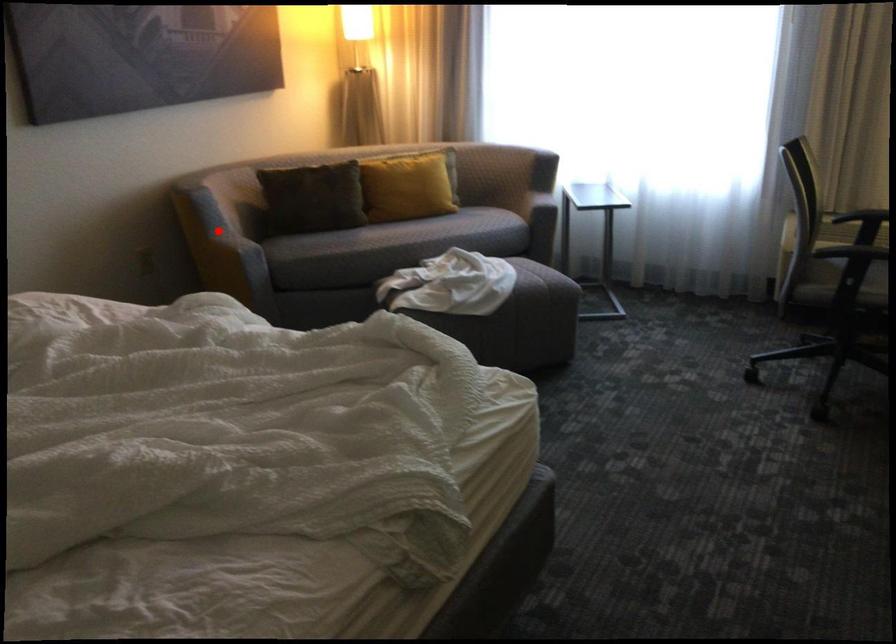
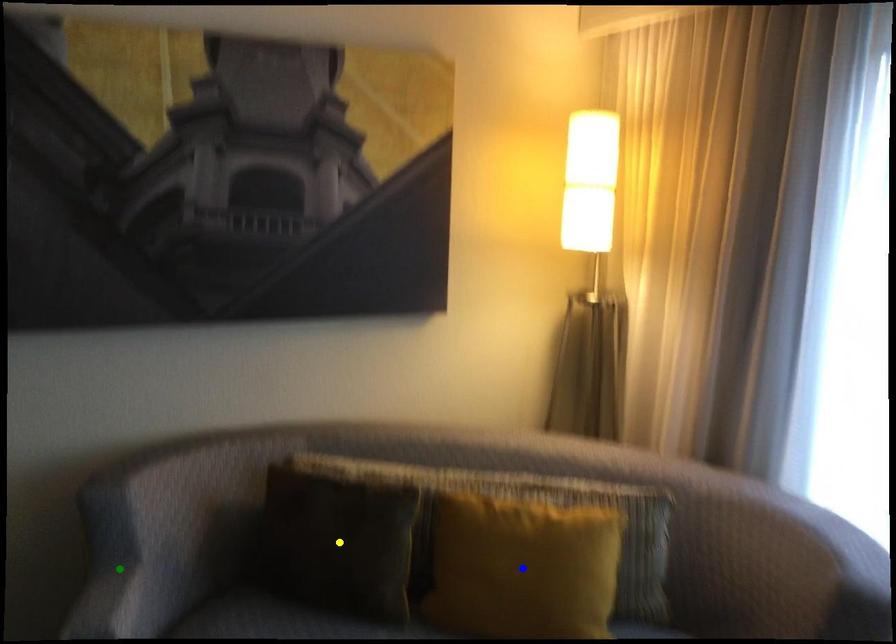
Question: I am providing you with two images of the same scene from different viewpoints. A red point is marked on the first image. You are given multiple points on the second image. Which mark in image 2 goes with the point in image 1?

Choices:
 (A) blue point
 (B) green point
 (C) yellow point

Answer: (B)